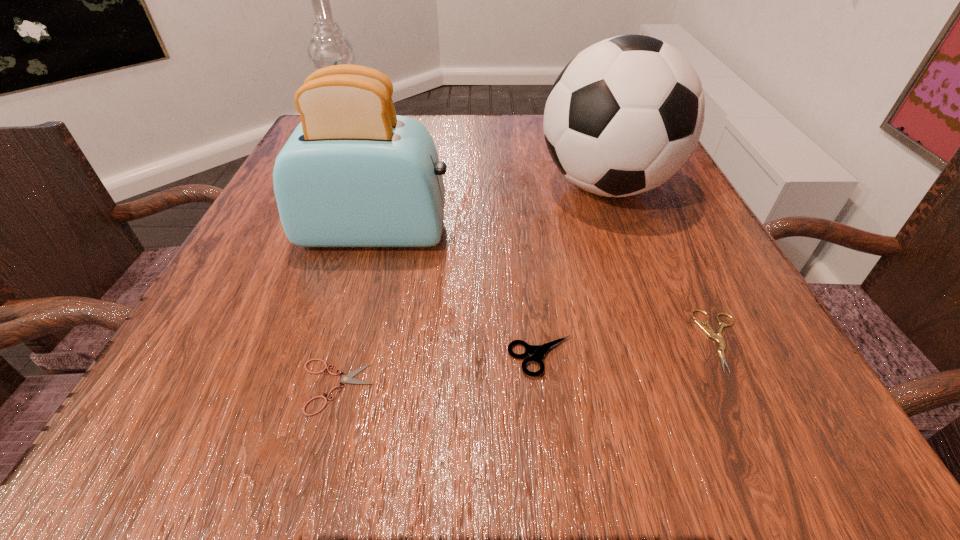
Locate an element on the screen. The image size is (960, 540). oil lamp is located at coordinates (328, 46).

The image size is (960, 540). I want to click on toaster, so click(353, 173).

Image resolution: width=960 pixels, height=540 pixels. In order to click on soccer ball in this screenshot , I will do `click(624, 116)`.

Locate an element on the screen. the second shears from right to left is located at coordinates (538, 351).

At what (x,y) coordinates should I click in order to perform the action: click on the third shortest object. Please return your answer as a coordinate pair (x, y). The image size is (960, 540). Looking at the image, I should click on (538, 351).

You are a GUI agent. You are given a task and a screenshot of the screen. Output one action in this format:
    pyautogui.click(x=<x>, y=<y>)
    Task: Click on the second shortest object
    This screenshot has height=540, width=960.
    Given the screenshot: What is the action you would take?
    pyautogui.click(x=709, y=331)

Find the location of a particular element. The width and height of the screenshot is (960, 540). the rightmost shears is located at coordinates (709, 331).

You are a GUI agent. You are given a task and a screenshot of the screen. Output one action in this format:
    pyautogui.click(x=<x>, y=<y>)
    Task: Click on the shortest object
    The width and height of the screenshot is (960, 540).
    Given the screenshot: What is the action you would take?
    pyautogui.click(x=347, y=378)

Where is `the shortest shears`? This screenshot has height=540, width=960. the shortest shears is located at coordinates (347, 378).

Where is `vacant point located on the right of the oil lamp`? The image size is (960, 540). vacant point located on the right of the oil lamp is located at coordinates (569, 145).